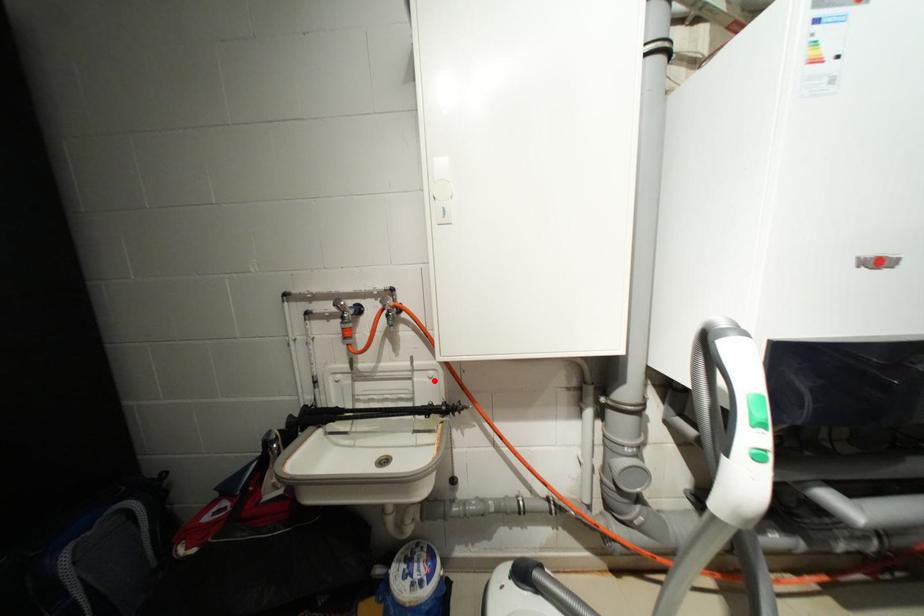
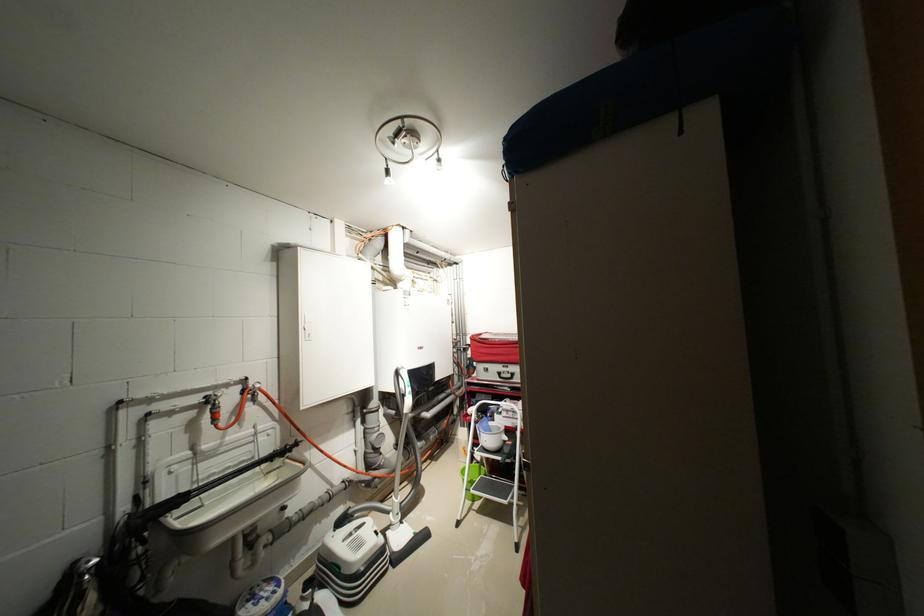
Question: I am providing you with two images of the same scene from different viewpoints. A red point is shown in image1. For the corresponding object point in image2, is it positioned nearer or farther from the camera?

Choices:
 (A) Nearer
 (B) Farther

Answer: (A)